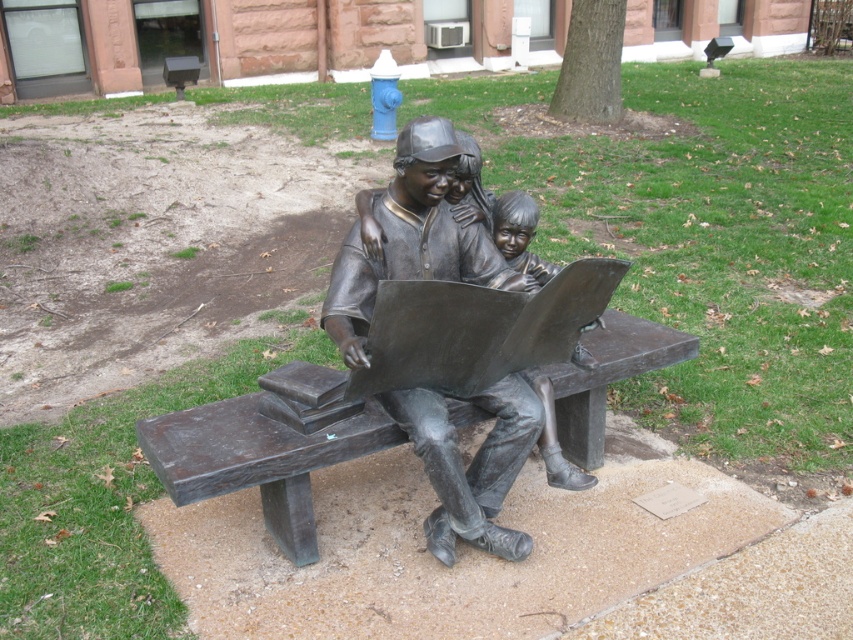
Who is positioned more to the left, bronze statue at center or bronze bench at center?

bronze bench at center

Does bronze statue at center have a lesser width compared to bronze bench at center?

Correct, bronze statue at center's width is less than bronze bench at center's.

Find the location of a particular element. The width and height of the screenshot is (853, 640). bronze statue at center is located at coordinates (413, 237).

Locate an element on the screen. The height and width of the screenshot is (640, 853). bronze statue at center is located at coordinates (413, 237).